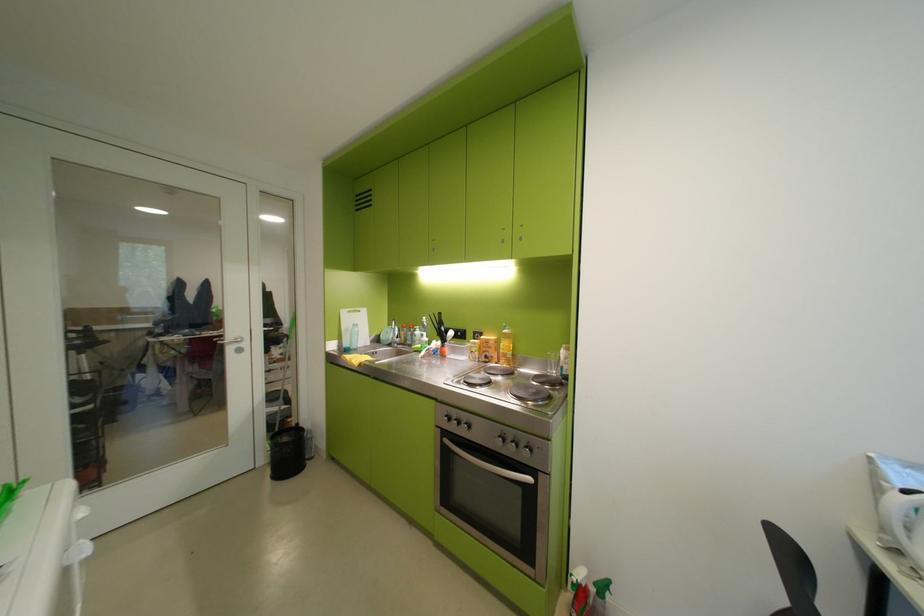
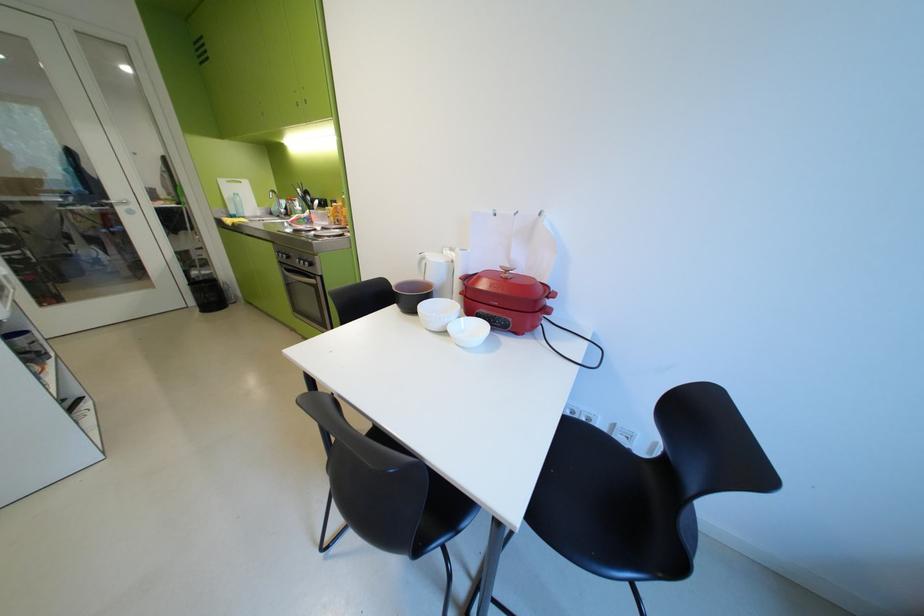
Which direction would the cameraman need to move to produce the second image?

The movement direction of the cameraman is right, backward.